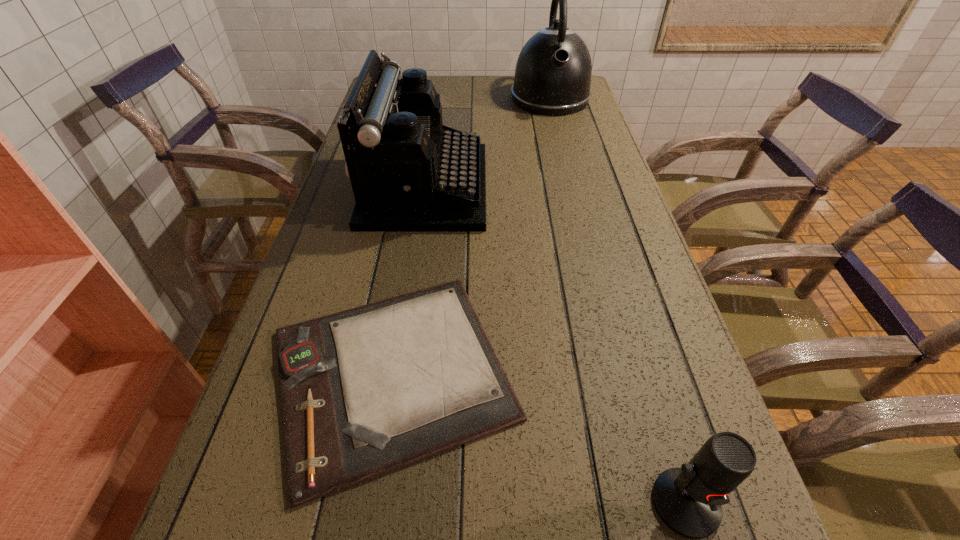
In order to click on kettle that is at the right edge in this screenshot , I will do `click(553, 72)`.

Identify the location of microphone that is at the right edge. pyautogui.click(x=688, y=499).

Locate an element on the screen. object that is at the far right corner is located at coordinates (x=553, y=72).

The width and height of the screenshot is (960, 540). I want to click on free point at the far edge, so click(x=484, y=81).

This screenshot has height=540, width=960. What are the coordinates of `free space at the left edge of the desktop` in the screenshot? It's located at click(x=252, y=413).

Identify the location of free space at the right edge. Image resolution: width=960 pixels, height=540 pixels. (571, 184).

Find the location of `free space between the kettle and the shortest object`. free space between the kettle and the shortest object is located at coordinates (471, 235).

Where is `vacant point located between the second farthest object and the clipboard`? The image size is (960, 540). vacant point located between the second farthest object and the clipboard is located at coordinates (409, 280).

The height and width of the screenshot is (540, 960). I want to click on free space between the clipboard and the microphone, so click(539, 438).

Locate an element on the screen. This screenshot has width=960, height=540. vacant area between the typewriter and the second shortest object is located at coordinates (555, 345).